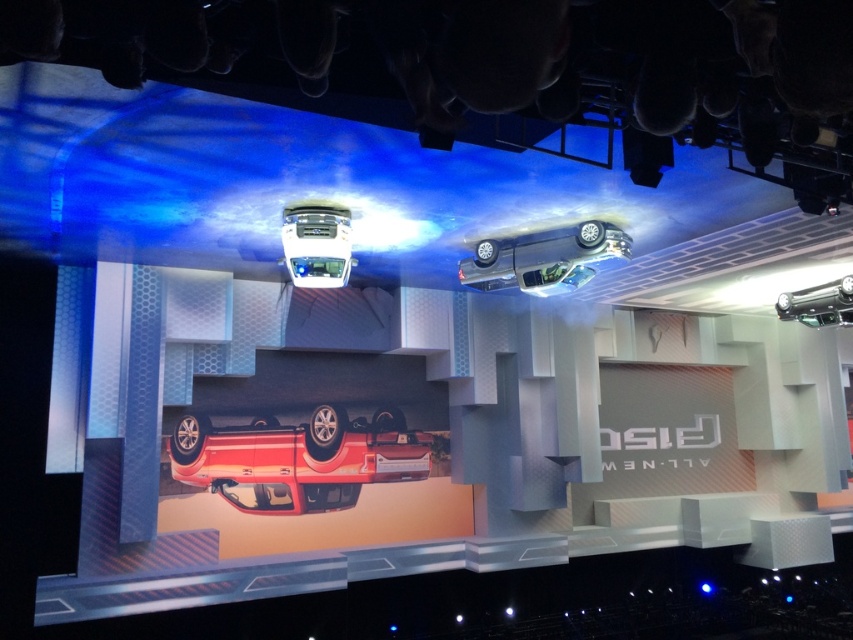
Can you confirm if shiny red car at center is bigger than shiny silver car at center?

Yes, shiny red car at center is bigger than shiny silver car at center.

Based on the photo, does shiny red car at center come in front of shiny silver car at center?

No, it is behind shiny silver car at center.

Between point (213, 433) and point (790, 307), which one is positioned in front?

Positioned in front is point (213, 433).

Find the location of a particular element. The image size is (853, 640). shiny red car at center is located at coordinates [300, 458].

Who is taller, shiny red car at center or satin silver car at upper center?

shiny red car at center

Who is more forward, (x=438, y=444) or (x=549, y=243)?

Point (x=549, y=243) is more forward.

Where is `shiny red car at center`? shiny red car at center is located at coordinates (300, 458).

You are a GUI agent. You are given a task and a screenshot of the screen. Output one action in this format:
    pyautogui.click(x=<x>, y=<y>)
    Task: Click on the shiny red car at center
    The height and width of the screenshot is (640, 853).
    Given the screenshot: What is the action you would take?
    pyautogui.click(x=300, y=458)

The width and height of the screenshot is (853, 640). What are the coordinates of `sleek silver car at center` in the screenshot? It's located at (316, 244).

At what (x,y) coordinates should I click in order to perform the action: click on sleek silver car at center. Please return your answer as a coordinate pair (x, y). This screenshot has width=853, height=640. Looking at the image, I should click on (316, 244).